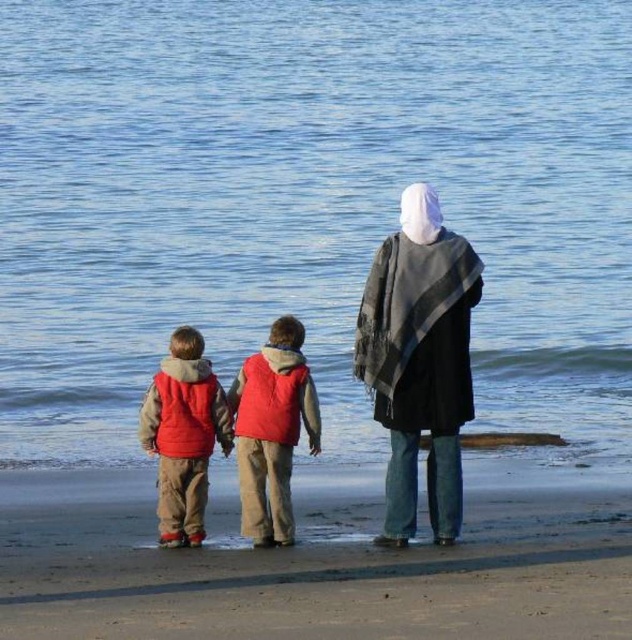
Question: Estimate the real-world distances between objects in this image. Which object is closer to the red fleece vest at center?

Choices:
 (A) gray woolen shawl at center
 (B) red fleece vests at center
 (C) matte red vest at left

Answer: (C)

Question: Is gray woolen shawl at center to the left of red fleece vest at center from the viewer's perspective?

Choices:
 (A) no
 (B) yes

Answer: (A)

Question: Can you confirm if blue water at center is wider than matte red vest at left?

Choices:
 (A) no
 (B) yes

Answer: (B)

Question: Among these objects, which one is farthest from the camera?

Choices:
 (A) gray woolen shawl at center
 (B) blue water at center

Answer: (B)

Question: Which point is closer to the camera taking this photo?

Choices:
 (A) (295, 442)
 (B) (423, 429)
 (C) (518, 74)
 (D) (363, 620)

Answer: (D)

Question: Can you confirm if gray woolen shawl at center is positioned below red fleece vest at center?

Choices:
 (A) yes
 (B) no

Answer: (B)